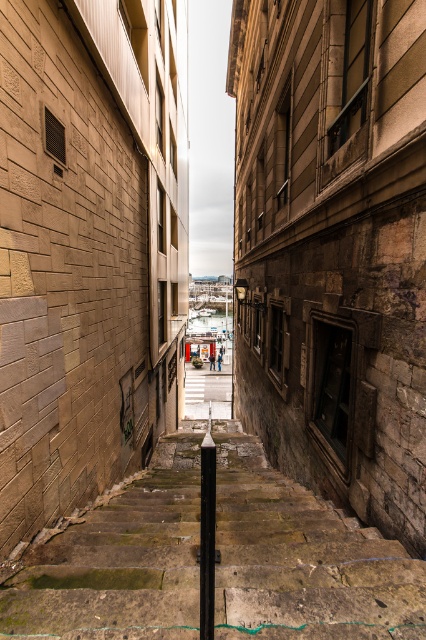
Question: Can you confirm if green mossy stone stairs at center is bigger than brick wall at center?

Choices:
 (A) no
 (B) yes

Answer: (A)

Question: Can you confirm if green mossy stone stairs at center is bigger than brick wall at center?

Choices:
 (A) yes
 (B) no

Answer: (B)

Question: Which point appears closest to the camera in this image?

Choices:
 (A) (339, 556)
 (B) (184, 403)

Answer: (A)

Question: Can you confirm if green mossy stone stairs at center is positioned to the right of brick wall at center?

Choices:
 (A) yes
 (B) no

Answer: (A)